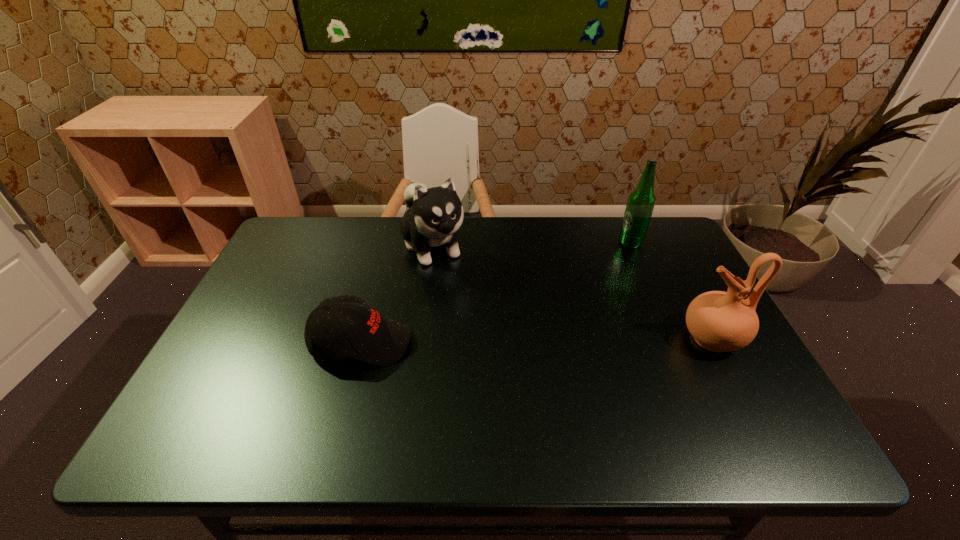
Where is `vacant point at the near edge`? The image size is (960, 540). vacant point at the near edge is located at coordinates (665, 395).

Where is `blank area at the left edge`? This screenshot has height=540, width=960. blank area at the left edge is located at coordinates (272, 308).

Find the location of a particular element. This screenshot has width=960, height=540. free region at the right edge is located at coordinates (664, 297).

This screenshot has height=540, width=960. In order to click on vacant space at the far left corner of the desktop in this screenshot , I will do `click(291, 245)`.

I want to click on vacant space at the near left corner of the desktop, so click(245, 381).

Identify the location of free space that is in between the pottery and the puppy. The width and height of the screenshot is (960, 540). (573, 292).

The width and height of the screenshot is (960, 540). I want to click on vacant space that's between the baseball cap and the beer bottle, so click(x=496, y=293).

This screenshot has width=960, height=540. Identify the location of empty location between the pottery and the shortest object. (537, 340).

Image resolution: width=960 pixels, height=540 pixels. Identify the location of vacant point located between the puppy and the pottery. (573, 292).

Locate an element on the screen. The width and height of the screenshot is (960, 540). vacant point located between the pottery and the beer bottle is located at coordinates (671, 291).